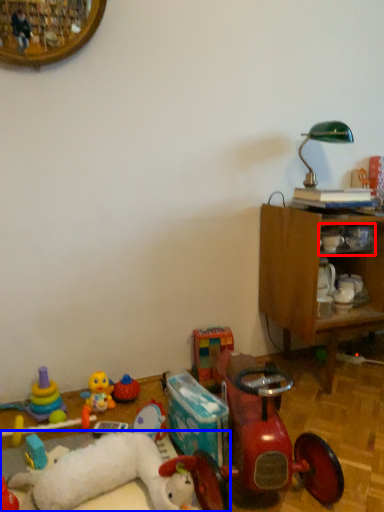
Question: Which of the following is the closest to the observer, shelf (highlighted by a red box) or toy (highlighted by a blue box)?

Choices:
 (A) shelf
 (B) toy

Answer: (B)